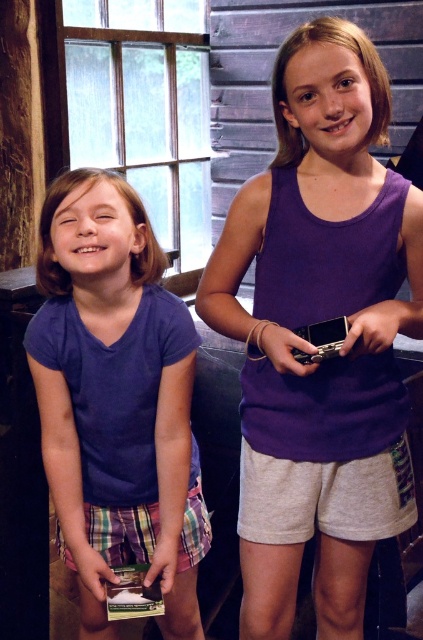
Question: From the image, what is the correct spatial relationship of purple matte tank top at center in relation to purple cotton shirt at left?

Choices:
 (A) left
 (B) right

Answer: (B)

Question: Which point is farther to the camera?

Choices:
 (A) (137, 218)
 (B) (343, 579)

Answer: (B)

Question: Is purple matte tank top at center further to the viewer compared to purple cotton shirt at left?

Choices:
 (A) yes
 (B) no

Answer: (B)

Question: Which point is closer to the camera taking this photo?

Choices:
 (A) (140, 531)
 (B) (285, 250)

Answer: (B)

Question: Which of the following is the farthest from the observer?

Choices:
 (A) (282, 564)
 (B) (66, 426)

Answer: (B)

Question: In this image, where is purple matte tank top at center located relative to purple cotton shirt at left?

Choices:
 (A) above
 (B) below

Answer: (A)